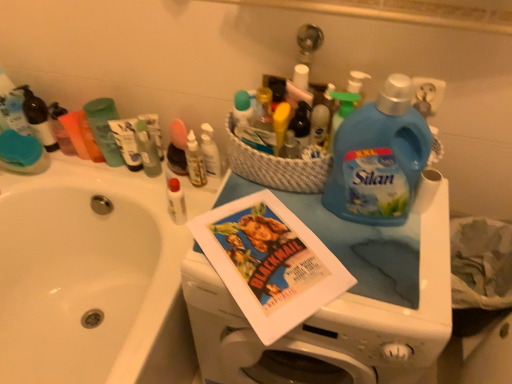
Question: Does translucent plastic bottle at center, the 1th toiletry positioned from the right, have a lesser height compared to white glossy sink at left?

Choices:
 (A) yes
 (B) no

Answer: (A)

Question: Can white glossy sink at left be found inside translucent plastic bottle at center, the third toiletry from the left?

Choices:
 (A) yes
 (B) no

Answer: (B)

Question: Is translucent plastic bottle at center, the third toiletry from the left, outside white glossy sink at left?

Choices:
 (A) yes
 (B) no

Answer: (A)

Question: Is the surface of translucent plastic bottle at center, the third toiletry from the left, in direct contact with white glossy sink at left?

Choices:
 (A) yes
 (B) no

Answer: (B)

Question: Are translucent plastic bottle at center, the third toiletry from the left, and white glossy sink at left located far from each other?

Choices:
 (A) no
 (B) yes

Answer: (A)

Question: From a real-world perspective, is translucent plastic bottle at center, the 1th toiletry positioned from the right, positioned under white glossy sink at left based on gravity?

Choices:
 (A) no
 (B) yes

Answer: (A)

Question: From the image's perspective, is translucent plastic bottle at center, the 1th toiletry positioned from the right, below blue plastic laundry detergent at upper right?

Choices:
 (A) yes
 (B) no

Answer: (B)

Question: Considering the relative positions of translucent plastic bottle at center, the third toiletry from the left, and blue plastic laundry detergent at upper right in the image provided, is translucent plastic bottle at center, the third toiletry from the left, behind blue plastic laundry detergent at upper right?

Choices:
 (A) yes
 (B) no

Answer: (A)

Question: Can you confirm if translucent plastic bottle at center, the 1th toiletry positioned from the right, is smaller than blue plastic laundry detergent at upper right?

Choices:
 (A) no
 (B) yes

Answer: (B)

Question: Does translucent plastic bottle at center, the third toiletry from the left, have a lesser width compared to blue plastic laundry detergent at upper right?

Choices:
 (A) yes
 (B) no

Answer: (A)

Question: Is blue plastic laundry detergent at upper right inside translucent plastic bottle at center, the 1th toiletry positioned from the right?

Choices:
 (A) no
 (B) yes

Answer: (A)

Question: From the image's perspective, does translucent plastic bottle at center, the 1th toiletry positioned from the right, appear higher than blue plastic laundry detergent at upper right?

Choices:
 (A) yes
 (B) no

Answer: (A)

Question: Is green plastic shampoo bottle at upper left, the 2th toiletry positioned from the left, thinner than white paper at right?

Choices:
 (A) yes
 (B) no

Answer: (B)